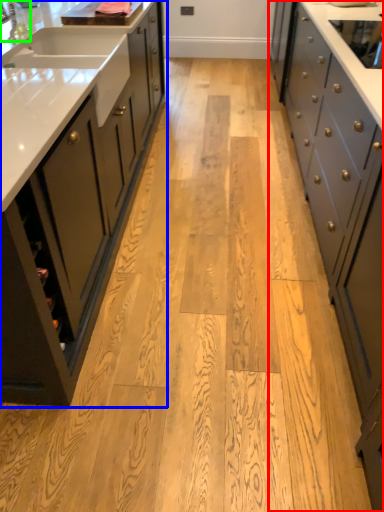
Question: Which object is the closest to the cabinetry (highlighted by a red box)? Choose among these: cabinetry (highlighted by a blue box) or faucet (highlighted by a green box).

Choices:
 (A) cabinetry
 (B) faucet

Answer: (A)